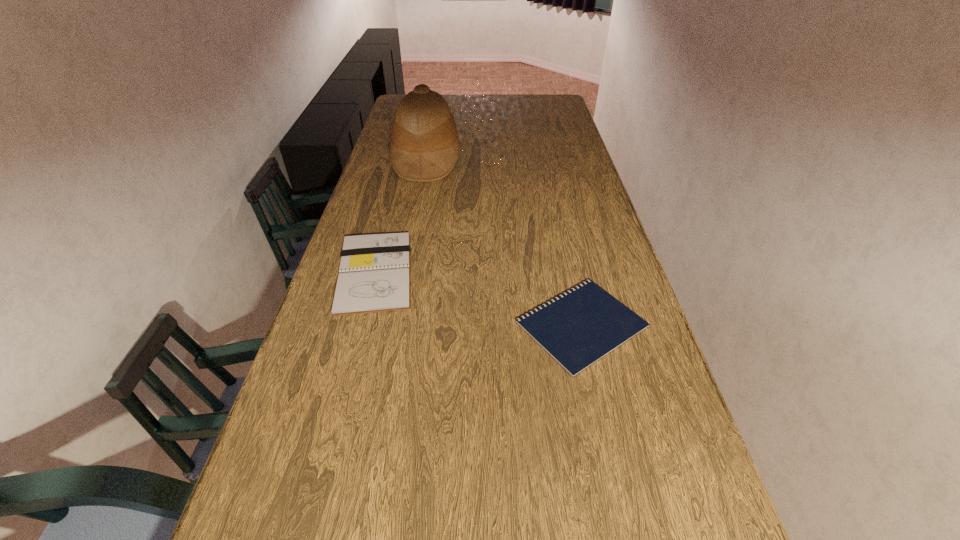
The width and height of the screenshot is (960, 540). In order to click on notepad present at the left edge in this screenshot , I will do `click(374, 276)`.

You are a GUI agent. You are given a task and a screenshot of the screen. Output one action in this format:
    pyautogui.click(x=<x>, y=<y>)
    Task: Click on the object that is at the right edge
    The height and width of the screenshot is (540, 960).
    Given the screenshot: What is the action you would take?
    pyautogui.click(x=578, y=328)

At what (x,y) coordinates should I click in order to perform the action: click on free spot at the left edge of the desktop. Please return your answer as a coordinate pair (x, y). Looking at the image, I should click on (351, 231).

The height and width of the screenshot is (540, 960). Identify the location of free space at the right edge of the desktop. (577, 137).

This screenshot has height=540, width=960. I want to click on vacant space at the far right corner of the desktop, so click(561, 96).

This screenshot has width=960, height=540. Identify the location of unoccupied area between the taller notepad and the rightmost object. (478, 299).

Where is `vacant area between the right notepad and the tallest object`? The height and width of the screenshot is (540, 960). vacant area between the right notepad and the tallest object is located at coordinates click(504, 242).

You are a GUI agent. You are given a task and a screenshot of the screen. Output one action in this format:
    pyautogui.click(x=<x>, y=<y>)
    Task: Click on the vacant region between the right notepad and the tallest object
    The width and height of the screenshot is (960, 540).
    Given the screenshot: What is the action you would take?
    pyautogui.click(x=504, y=242)

I want to click on free space between the tallest object and the left notepad, so click(x=400, y=217).

Identify the location of vacant space that is in between the tallest object and the second tallest object. tap(400, 217).